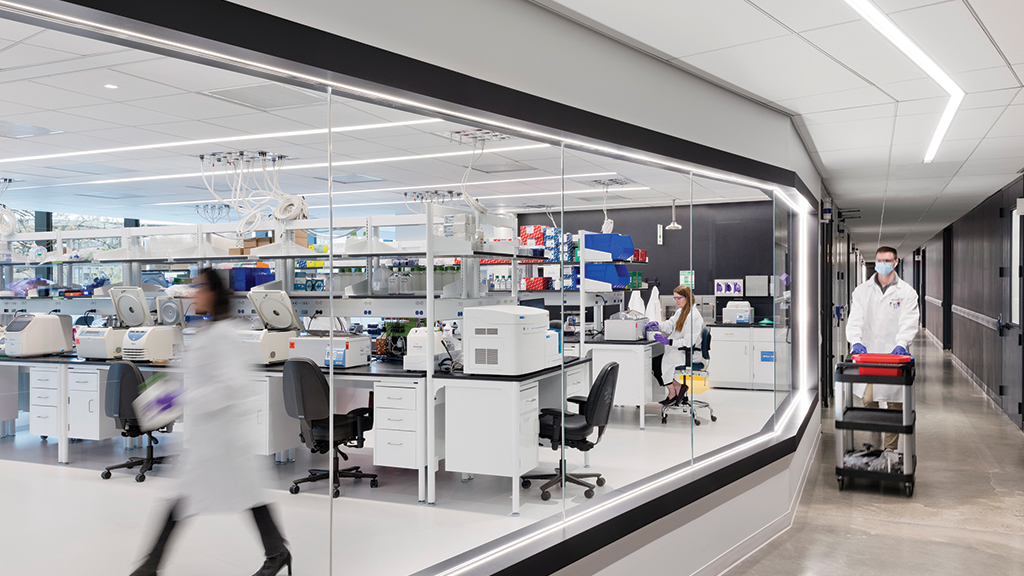
Where is `rolling chair`? rolling chair is located at coordinates (x=557, y=423), (x=354, y=427).